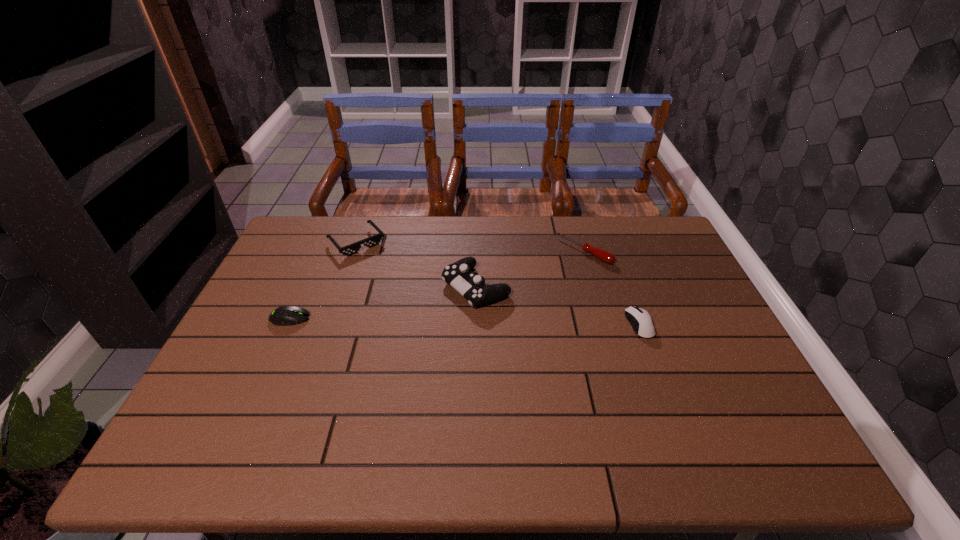
This screenshot has width=960, height=540. What are the coordinates of `free spot on the desktop that is between the shorter mouse and the right mouse and is positioned at the tip of the screwdriver` in the screenshot? It's located at [494, 322].

You are a GUI agent. You are given a task and a screenshot of the screen. Output one action in this format:
    pyautogui.click(x=<x>, y=<y>)
    Task: Click on the free space on the desktop that is between the left mouse and the right mouse and is positioned on the surface of the third object from left to right
    The image size is (960, 540).
    Given the screenshot: What is the action you would take?
    pyautogui.click(x=412, y=320)

What are the coordinates of `vacant space on the desktop that is between the shorter mouse and the right mouse and is positioned on the front-facing side of the sunglasses` in the screenshot? It's located at (426, 321).